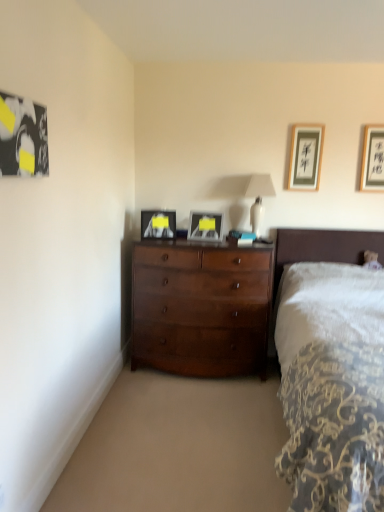
Question: Visually, is shiny brown dresser at center positioned to the left or to the right of black wood picture frame at upper right, the fifth picture frame positioned from the left?

Choices:
 (A) right
 (B) left

Answer: (B)

Question: Does point (210, 332) appear closer or farther from the camera than point (370, 148)?

Choices:
 (A) farther
 (B) closer

Answer: (B)

Question: Which object is positioned farthest from the shiny brown dresser at center?

Choices:
 (A) dark wood bed at right
 (B) matte black picture frame at center, which ranks as the third picture frame in front-to-back order
 (C) black matte picture frame at upper left, acting as the fifth picture frame starting from the right
 (D) black wood picture frame at upper right, the second picture frame from the back
 (E) white glossy table lamp at upper center

Answer: (C)

Question: Which object is the closest to the black matte picture frame at upper left, which appears as the first picture frame when viewed from the left?

Choices:
 (A) shiny brown dresser at center
 (B) black wood picture frame at upper right, the second picture frame from the back
 (C) matte black picture frame at upper right, which ranks as the first picture frame in back-to-front order
 (D) matte black picture frame at center, which is counted as the second picture frame, starting from the left
 (E) metallic silver picture frame at center, the third picture frame in the left-to-right sequence

Answer: (D)